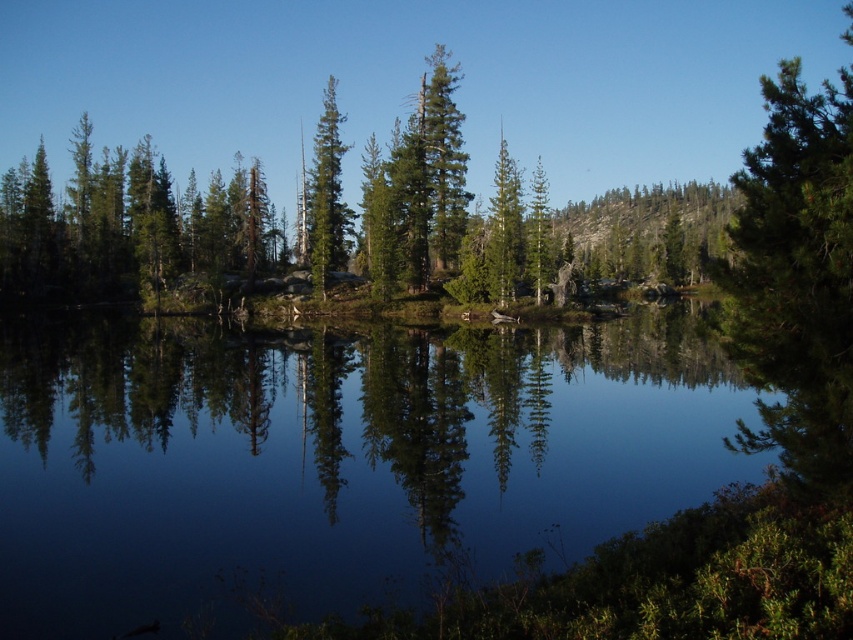
Question: Which object is the closest to the transparent water at center?

Choices:
 (A) green matte tree at center
 (B) green textured pine tree at right

Answer: (B)

Question: Is transparent water at center positioned before green matte tree at center?

Choices:
 (A) no
 (B) yes

Answer: (B)

Question: Considering the relative positions of transparent water at center and green matte tree at center in the image provided, where is transparent water at center located with respect to green matte tree at center?

Choices:
 (A) above
 (B) below

Answer: (B)

Question: Which object appears closest to the camera in this image?

Choices:
 (A) green matte tree at center
 (B) green textured pine tree at right
 (C) transparent water at center

Answer: (C)

Question: Which object is farther from the camera taking this photo?

Choices:
 (A) transparent water at center
 (B) green matte tree at center

Answer: (B)

Question: Observing the image, what is the correct spatial positioning of green textured pine tree at right in reference to green matte tree at center?

Choices:
 (A) left
 (B) right

Answer: (B)